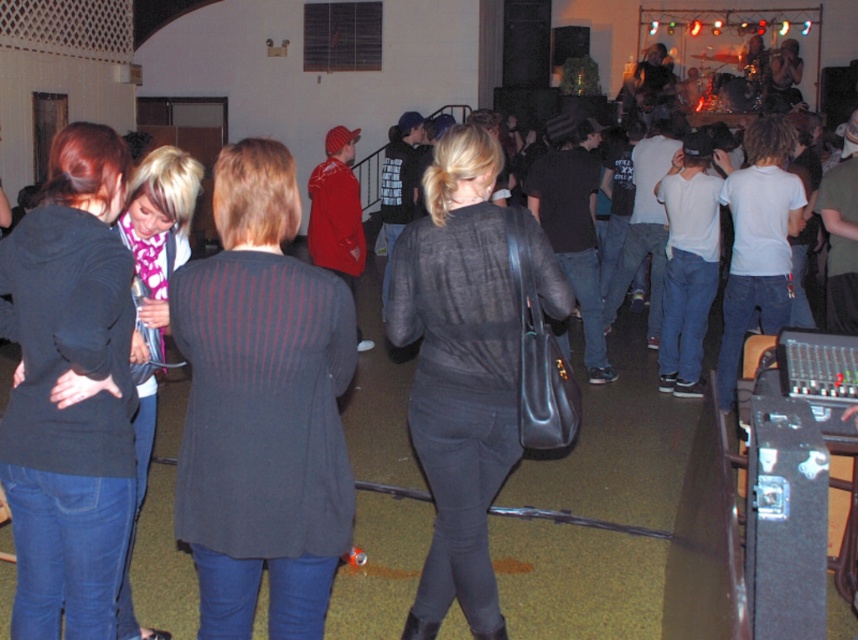
Looking at this image, you are standing in the center of the room and want to hand a gift to the person wearing the dark gray textured sweater at center. According to the spatial coordinates provided, in which direction should you move to reach them?

The dark gray textured sweater at center is located at point (263, 406), which means you should move towards the right and slightly forward from your current position at the center to reach them.

You are a photographer at the event and want to capture a photo of the two people wearing the dark gray textured sweater at center and the matte black shirt at center. Which clothing item is positioned higher on the person to ensure proper framing?

The dark gray textured sweater at center is located above the matte black shirt at center, so the sweater is positioned higher and should be framed accordingly.